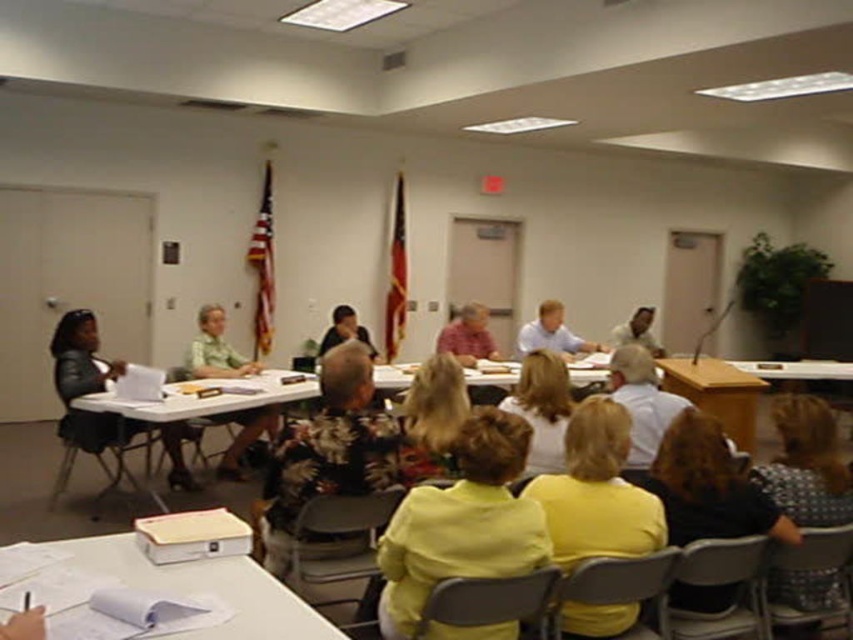
Question: Does black plastic chair at left have a lesser width compared to gray plastic chair at lower right?

Choices:
 (A) yes
 (B) no

Answer: (B)

Question: Which of these objects is positioned farthest from the metallic gray chair at lower center?

Choices:
 (A) matte plastic chair at lower right
 (B) white paper at lower left

Answer: (A)

Question: Based on their relative distances, which object is nearer to the metallic gray chair at lower center?

Choices:
 (A) green matte shirt at center
 (B) light brown hair at center

Answer: (B)

Question: Can you confirm if light brown hair at center is positioned to the left of gray plastic chair at lower right?

Choices:
 (A) no
 (B) yes

Answer: (B)

Question: Can you confirm if leather jacket at left is positioned above matte plastic chair at lower right?

Choices:
 (A) no
 (B) yes

Answer: (B)

Question: Which object appears closest to the camera in this image?

Choices:
 (A) white plastic table at center
 (B) leather jacket at left

Answer: (A)